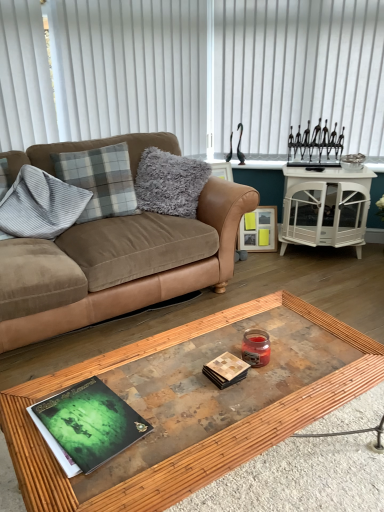
In order to click on free point to the left of green matte magazine at center, marked as the first magazine in a right-to-left arrangement in this screenshot , I will do `click(178, 377)`.